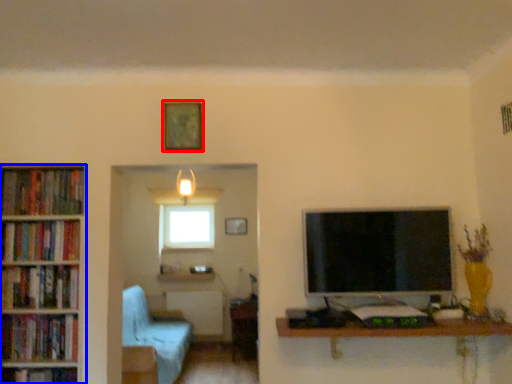
Question: Which object appears farthest to the camera in this image, picture frame (highlighted by a red box) or bookcase (highlighted by a blue box)?

Choices:
 (A) picture frame
 (B) bookcase

Answer: (A)